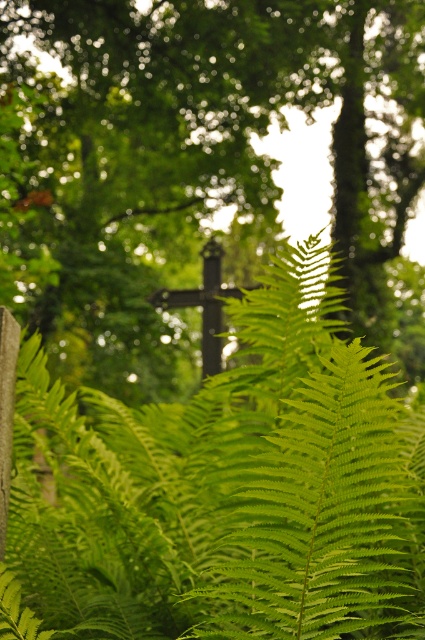
Can you confirm if green leafy fern at center is positioned to the right of dark brown wooden cross at center?

Correct, you'll find green leafy fern at center to the right of dark brown wooden cross at center.

Between green leafy fern at center and dark brown wooden cross at center, which one appears on the right side from the viewer's perspective?

From the viewer's perspective, green leafy fern at center appears more on the right side.

Does point (345, 499) come closer to viewer compared to point (204, 372)?

Yes.

This screenshot has height=640, width=425. I want to click on green leafy fern at center, so click(325, 516).

Is green leafy fern at lower center further to the viewer compared to green leafy fern at center?

Yes, green leafy fern at lower center is behind green leafy fern at center.

Between green leafy fern at lower center and green leafy fern at center, which one is positioned higher?

green leafy fern at lower center

Is point (164, 54) in front of point (229, 502)?

No, (164, 54) is behind (229, 502).

The image size is (425, 640). I want to click on green leafy fern at lower center, so click(198, 168).

Is point (410, 355) closer to viewer compared to point (214, 291)?

No, it is behind (214, 291).

Does green leafy fern at lower center have a lesser height compared to dark brown wooden cross at center?

Incorrect, green leafy fern at lower center's height does not fall short of dark brown wooden cross at center's.

Is point (346, 38) more distant than point (206, 252)?

Yes.

Identify the location of green leafy fern at lower center. (198, 168).